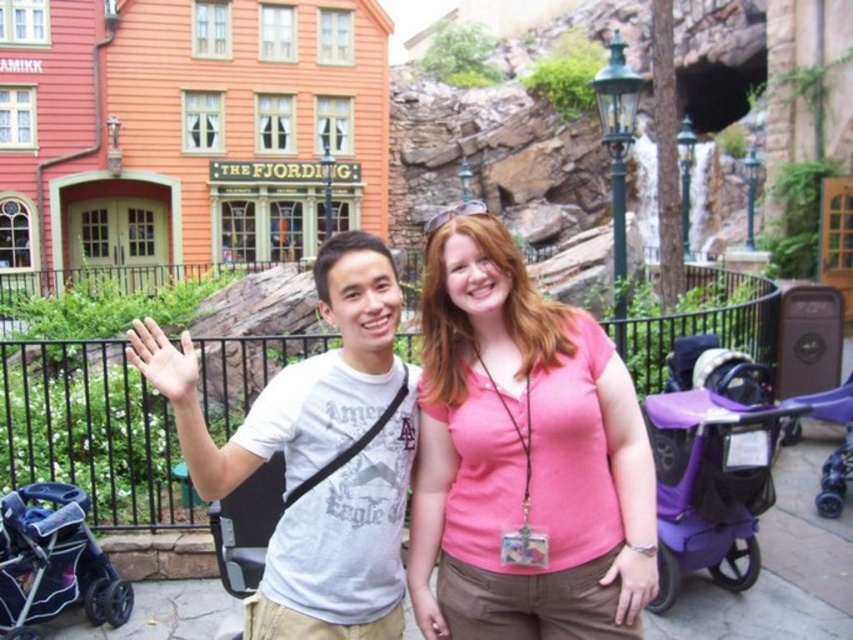
Is point (494, 356) closer to viewer compared to point (9, 593)?

No, (494, 356) is further to viewer.

Describe the element at coordinates (546, 442) in the screenshot. The height and width of the screenshot is (640, 853). I see `white cotton t-shirt at center` at that location.

Identify the location of white cotton t-shirt at center. The height and width of the screenshot is (640, 853). (546, 442).

Is white cotton t-shirt at center taller than purple matte baby carriage at lower right?

Yes, white cotton t-shirt at center is taller than purple matte baby carriage at lower right.

Which is in front, point (503, 616) or point (672, 420)?

Point (503, 616)

The image size is (853, 640). Identify the location of white cotton t-shirt at center. (546, 442).

Identify the location of pink matte shirt at center. This screenshot has width=853, height=640. (523, 456).

Which is in front, point (573, 356) or point (526, 586)?

Point (526, 586) is more forward.

Find the location of `pink matte shirt at center`. pink matte shirt at center is located at coordinates (523, 456).